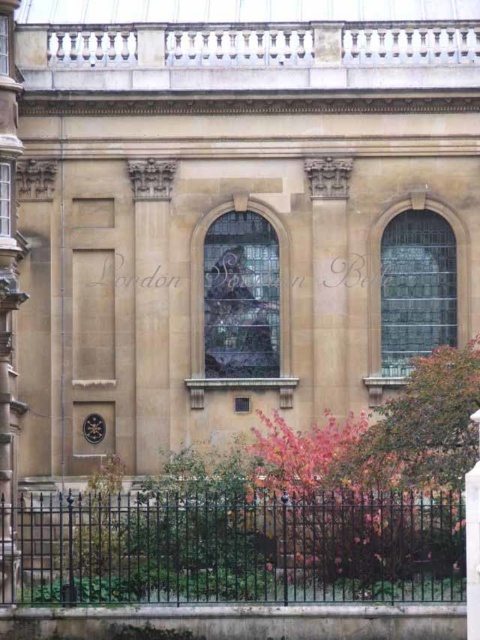
Can you confirm if black wrought iron fence at lower center is shorter than smooth stone pillar at left?

Indeed, black wrought iron fence at lower center has a lesser height compared to smooth stone pillar at left.

Which is below, black wrought iron fence at lower center or smooth stone pillar at left?

black wrought iron fence at lower center

Which is behind, point (420, 518) or point (0, 51)?

The point (0, 51) is more distant.

Where is `black wrought iron fence at lower center`? This screenshot has height=640, width=480. black wrought iron fence at lower center is located at coordinates click(x=239, y=548).

Does black wrought iron fence at lower center have a greater height compared to sandy stone column at center?

No.

Is black wrought iron fence at lower center thinner than sandy stone column at center?

No, black wrought iron fence at lower center is not thinner than sandy stone column at center.

Which is behind, point (435, 518) or point (479, 499)?

The point (435, 518) is more distant.

I want to click on black wrought iron fence at lower center, so click(x=239, y=548).

Can you confirm if smooth stone pillar at left is positioned below sandy stone column at center?

Actually, smooth stone pillar at left is above sandy stone column at center.

Is smooth stone pillar at left positioned in front of sandy stone column at center?

That is False.

You are a GUI agent. You are given a task and a screenshot of the screen. Output one action in this format:
    pyautogui.click(x=<x>, y=<y>)
    Task: Click on the smooth stone pillar at left
    
    Given the screenshot: What is the action you would take?
    pyautogui.click(x=8, y=291)

The height and width of the screenshot is (640, 480). What are the coordinates of `smooth stone pillar at left` in the screenshot? It's located at (8, 291).